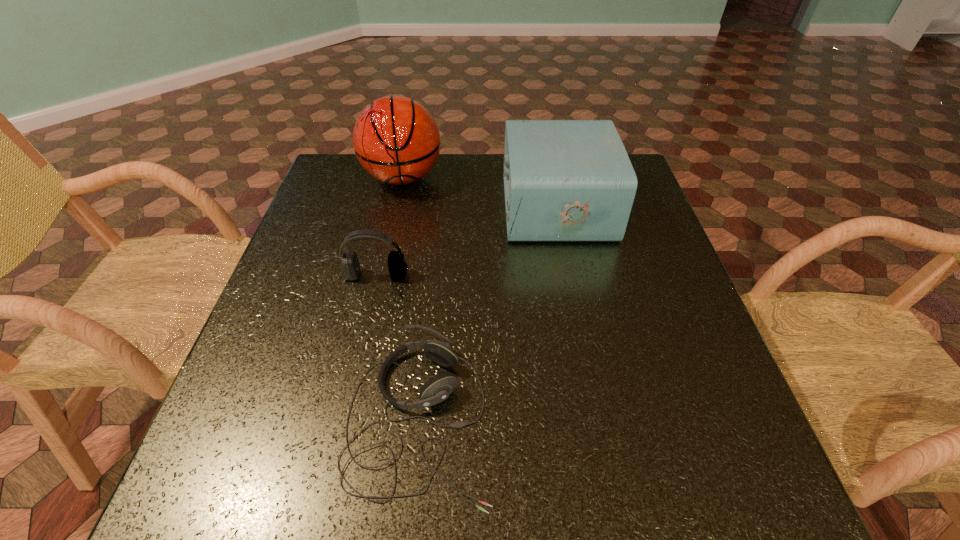
Image resolution: width=960 pixels, height=540 pixels. In order to click on object positioned at the far right corner in this screenshot , I will do point(564,180).

In the image, there is a desktop. At what (x,y) coordinates should I click in order to perform the action: click on vacant area at the far edge. Please return your answer as a coordinate pair (x, y). The width and height of the screenshot is (960, 540). Looking at the image, I should click on (444, 195).

Find the location of a particular element. This screenshot has height=540, width=960. free space at the near edge of the desktop is located at coordinates (355, 463).

The image size is (960, 540). Find the location of `free space at the left edge of the desktop`. free space at the left edge of the desktop is located at coordinates (237, 384).

Find the location of a particular element. Image resolution: width=960 pixels, height=540 pixels. vacant region at the right edge of the desktop is located at coordinates (602, 262).

The height and width of the screenshot is (540, 960). What are the coordinates of `vacant space at the far left corner of the desktop` in the screenshot? It's located at (341, 163).

Where is `free spot between the rightmost object and the nearer headset`? free spot between the rightmost object and the nearer headset is located at coordinates (488, 313).

You are a GUI agent. You are given a task and a screenshot of the screen. Output one action in this format:
    pyautogui.click(x=<x>, y=<y>)
    Task: Click on the vacant space that's between the nearest object and the second shortest object
    
    Given the screenshot: What is the action you would take?
    pyautogui.click(x=397, y=347)

Where is `vacant point located between the tallest object and the rightmost object`? vacant point located between the tallest object and the rightmost object is located at coordinates (479, 192).

Locate an element on the screen. This screenshot has height=540, width=960. vacant area that lies between the tallest object and the second shortest object is located at coordinates (389, 227).